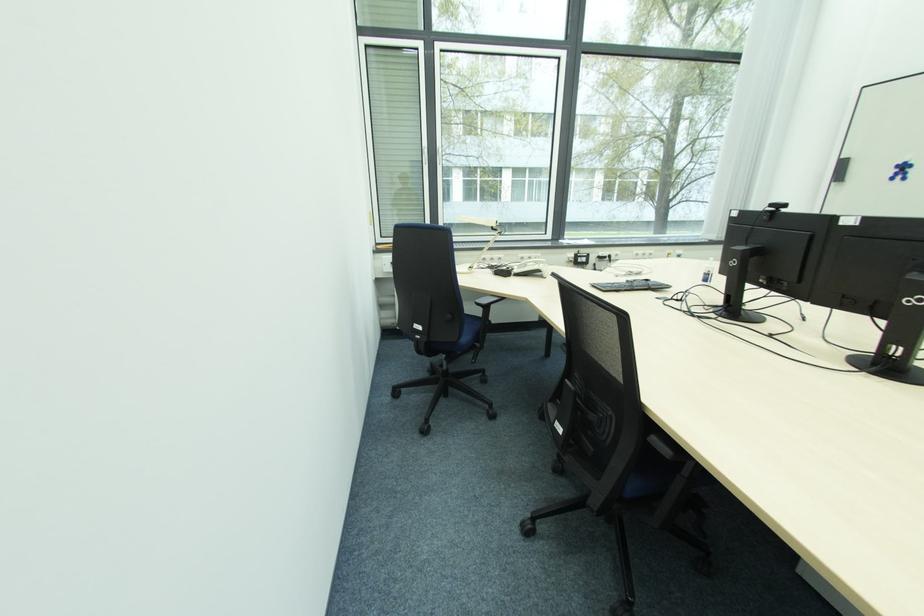
The height and width of the screenshot is (616, 924). What are the coordinates of `blue chair sitting surface` in the screenshot? It's located at (469, 326).